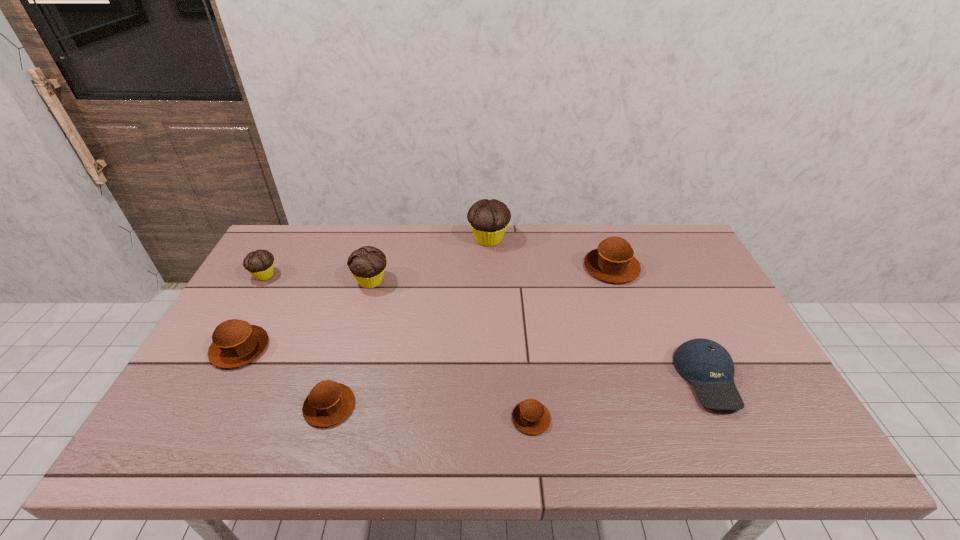
Identify the location of free region located 0.080m on the right of the shortest object. Image resolution: width=960 pixels, height=540 pixels. (585, 418).

Locate an element on the screen. object that is at the right edge is located at coordinates (707, 365).

Find the location of a particular element. The width and height of the screenshot is (960, 540). object that is at the far left corner is located at coordinates (260, 263).

The height and width of the screenshot is (540, 960). In order to click on vacant space at the far edge of the desktop in this screenshot , I will do `click(607, 230)`.

Find the location of a particular element. The image size is (960, 540). vacant space at the near edge of the desktop is located at coordinates (566, 442).

In order to click on vacant space at the left edge of the desktop in this screenshot , I will do `click(259, 290)`.

At what (x,y) coordinates should I click in order to perform the action: click on vacant space at the right edge. Please return your answer as a coordinate pair (x, y). Looking at the image, I should click on (768, 381).

Where is `free location at the far left corner of the desktop`? free location at the far left corner of the desktop is located at coordinates (324, 228).

Where is `empty location between the smallest chocolate muffin and the rightmost brown muffin`? empty location between the smallest chocolate muffin and the rightmost brown muffin is located at coordinates (438, 271).

Identify the location of free area in between the rightmost brown muffin and the smallest brown muffin. The height and width of the screenshot is (540, 960). (571, 342).